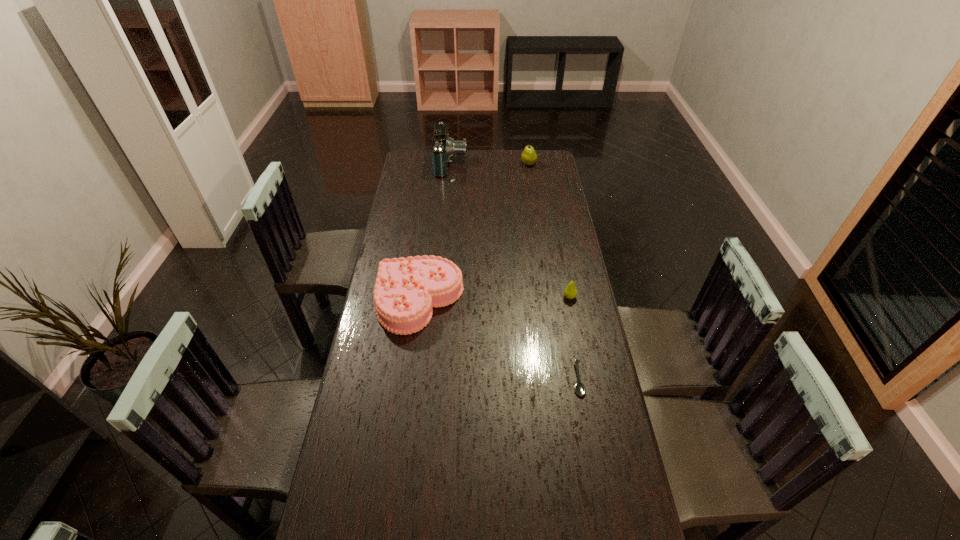
Identify the location of blank area located 0.290m on the back of the right pear. The width and height of the screenshot is (960, 540). (559, 242).

At what (x,y) coordinates should I click in order to perform the action: click on free region located 0.350m on the front of the cake. Please return your answer as a coordinate pair (x, y). The width and height of the screenshot is (960, 540). Looking at the image, I should click on (402, 434).

In order to click on vacant area situated 0.370m on the front of the shortest object in this screenshot , I will do `click(606, 534)`.

This screenshot has width=960, height=540. I want to click on camcorder located at the far edge, so click(x=443, y=148).

Where is `pear that is positioned at the far edge`? This screenshot has height=540, width=960. pear that is positioned at the far edge is located at coordinates (529, 157).

Identify the location of camcorder that is at the left edge. (443, 148).

This screenshot has width=960, height=540. I want to click on cake at the left edge, so [406, 289].

At what (x,y) coordinates should I click in order to perform the action: click on soupspoon that is at the right edge. Please return your answer as a coordinate pair (x, y). The width and height of the screenshot is (960, 540). Looking at the image, I should click on (580, 389).

You are a GUI agent. You are given a task and a screenshot of the screen. Output one action in this format:
    pyautogui.click(x=<x>, y=<y>)
    Task: Click on the object at the far left corner
    
    Given the screenshot: What is the action you would take?
    pyautogui.click(x=443, y=148)

Find the location of a particular element. The width and height of the screenshot is (960, 540). object located at the far right corner is located at coordinates (529, 157).